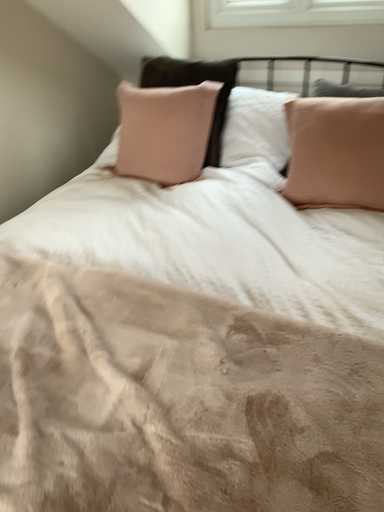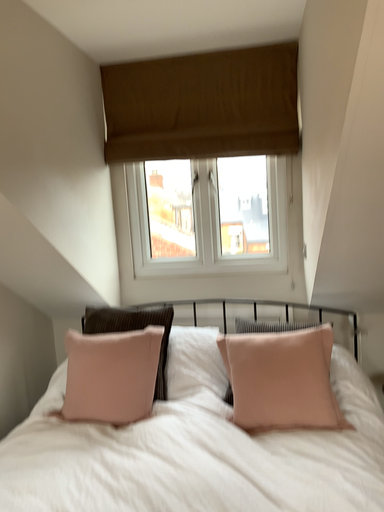
Question: Which way did the camera rotate in the video?

Choices:
 (A) rotated right
 (B) rotated left

Answer: (A)